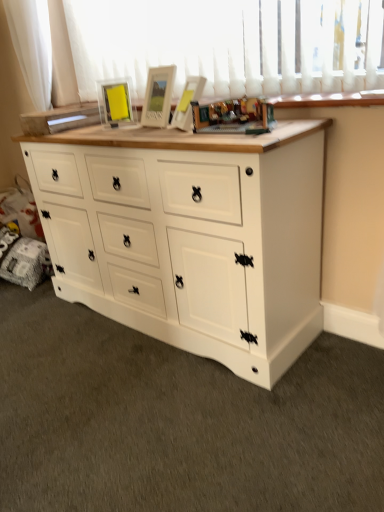
What do you see at coordinates (190, 236) in the screenshot?
I see `white painted wood chest of drawers at center` at bounding box center [190, 236].

The image size is (384, 512). What do you see at coordinates (32, 47) in the screenshot? I see `white fabric curtain at upper left` at bounding box center [32, 47].

You are a GUI agent. You are given a task and a screenshot of the screen. Output one action in this format:
    pyautogui.click(x=<x>, y=<y>)
    Task: Click on the white fabric curtain at upper left
    This screenshot has width=384, height=512.
    Given the screenshot: What is the action you would take?
    [x=32, y=47]

The width and height of the screenshot is (384, 512). What are the coordinates of `matte glass picture frame at upper center` in the screenshot? It's located at (115, 102).

Measure the distance between matte glass picture frame at upper center and camera.

Answer: matte glass picture frame at upper center is 1.73 meters away from camera.

At what (x,y) coordinates should I click in order to perform the action: click on white painted wood chest of drawers at center. Please return your answer as a coordinate pair (x, y). Looking at the image, I should click on (190, 236).

From the image's perspective, who appears lower, matte glass picture frame at upper center or white painted wood chest of drawers at center?

white painted wood chest of drawers at center, from the image's perspective.

Is matte glass picture frame at upper center turned away from white painted wood chest of drawers at center?

No, matte glass picture frame at upper center is not facing away from white painted wood chest of drawers at center.

Is matte glass picture frame at upper center in front of or behind white painted wood chest of drawers at center in the image?

matte glass picture frame at upper center is behind white painted wood chest of drawers at center.

Does white painted wood chest of drawers at center have a smaller size compared to white fabric curtain at upper left?

No.

Could you measure the distance between white painted wood chest of drawers at center and white fabric curtain at upper left?

white painted wood chest of drawers at center is 3.63 feet from white fabric curtain at upper left.

Can you confirm if white painted wood chest of drawers at center is positioned to the left of white fabric curtain at upper left?

No.

Is white fabric curtain at upper left at the left side of white painted wood chest of drawers at center?

Indeed, white fabric curtain at upper left is positioned on the left side of white painted wood chest of drawers at center.

You are a GUI agent. You are given a task and a screenshot of the screen. Output one action in this format:
    pyautogui.click(x=<x>, y=<y>)
    Task: Click on the chest of drawers below the white fabric curtain at upper left (from a real-world perspective)
    The height and width of the screenshot is (512, 384).
    Given the screenshot: What is the action you would take?
    pyautogui.click(x=190, y=236)

Does point (44, 100) appear closer or farther from the camera than point (286, 290)?

Point (44, 100) is positioned farther from the camera compared to point (286, 290).

Is white painted wood chest of drawers at center located within white fabric curtain at upper left?

No, white painted wood chest of drawers at center is not a part of white fabric curtain at upper left.

Based on the photo, how many degrees apart are the facing directions of wooden toy at center and white painted wood chest of drawers at center?

There is a 3.06-degree angle between the facing directions of wooden toy at center and white painted wood chest of drawers at center.

Is wooden toy at center bigger or smaller than white painted wood chest of drawers at center?

wooden toy at center is smaller than white painted wood chest of drawers at center.

Based on the photo, considering the sizes of objects wooden toy at center and white painted wood chest of drawers at center in the image provided, who is shorter, wooden toy at center or white painted wood chest of drawers at center?

Standing shorter between the two is wooden toy at center.

Does wooden toy at center have a lesser width compared to white painted wood chest of drawers at center?

Correct, the width of wooden toy at center is less than that of white painted wood chest of drawers at center.

From a real-world perspective, is wooden toy at center below matte glass picture frame at upper center?

Yes, from a real-world perspective, wooden toy at center is below matte glass picture frame at upper center.

Looking at their sizes, would you say wooden toy at center is wider or thinner than matte glass picture frame at upper center?

wooden toy at center is wider than matte glass picture frame at upper center.

Which of these two, wooden toy at center or matte glass picture frame at upper center, is bigger?

wooden toy at center is bigger.

Is wooden toy at center in contact with matte glass picture frame at upper center?

They are not placed beside each other.

From a real-world perspective, is matte glass picture frame at upper center positioned above or below wooden toy at center?

From a real-world perspective, matte glass picture frame at upper center is physically above wooden toy at center.

Is matte glass picture frame at upper center placed right next to wooden toy at center?

No, matte glass picture frame at upper center is not making contact with wooden toy at center.

Locate an element on the screen. The image size is (384, 512). picture frame to the left of wooden toy at center is located at coordinates (115, 102).

Looking at the image, does matte glass picture frame at upper center seem bigger or smaller compared to wooden toy at center?

Clearly, matte glass picture frame at upper center is smaller in size than wooden toy at center.

Would you say white painted wood chest of drawers at center is to the left or to the right of wooden toy at center in the picture?

In the image, white painted wood chest of drawers at center appears on the left side of wooden toy at center.

Is white painted wood chest of drawers at center beside wooden toy at center?

No.

Is wooden toy at center completely or partially inside white painted wood chest of drawers at center?

No, wooden toy at center is located outside of white painted wood chest of drawers at center.

Looking at this image, could you tell me if white painted wood chest of drawers at center is turned towards wooden toy at center?

No, white painted wood chest of drawers at center is not turned towards wooden toy at center.

Where is `chest of drawers in front of the matte glass picture frame at upper center`? chest of drawers in front of the matte glass picture frame at upper center is located at coordinates (190, 236).

Where is `curtain behind the white painted wood chest of drawers at center`? This screenshot has height=512, width=384. curtain behind the white painted wood chest of drawers at center is located at coordinates (32, 47).

Estimate the real-world distances between objects in this image. Which object is closer to matte glass picture frame at upper center, white fabric curtain at upper left or wooden toy at center?

white fabric curtain at upper left lies closer to matte glass picture frame at upper center than the other object.

Estimate the real-world distances between objects in this image. Which object is closer to white painted wood chest of drawers at center, wooden toy at center or matte glass picture frame at upper center?

Among the two, wooden toy at center is located nearer to white painted wood chest of drawers at center.

Considering their positions, is matte glass picture frame at upper center positioned closer to white fabric curtain at upper left than wooden toy at center?

matte glass picture frame at upper center.

When comparing their distances from matte glass picture frame at upper center, does white painted wood chest of drawers at center or white fabric curtain at upper left seem closer?

Based on the image, white fabric curtain at upper left appears to be nearer to matte glass picture frame at upper center.

When comparing their distances from white painted wood chest of drawers at center, does white fabric curtain at upper left or wooden toy at center seem further?

white fabric curtain at upper left is positioned further to the anchor white painted wood chest of drawers at center.

When comparing their distances from wooden toy at center, does white painted wood chest of drawers at center or white fabric curtain at upper left seem closer?

white painted wood chest of drawers at center is closer to wooden toy at center.

Estimate the real-world distances between objects in this image. Which object is closer to matte glass picture frame at upper center, wooden toy at center or white fabric curtain at upper left?

Based on the image, white fabric curtain at upper left appears to be nearer to matte glass picture frame at upper center.

When comparing their distances from wooden toy at center, does white fabric curtain at upper left or white painted wood chest of drawers at center seem closer?

white painted wood chest of drawers at center is positioned closer to the anchor wooden toy at center.

I want to click on toy positioned between white painted wood chest of drawers at center and matte glass picture frame at upper center from near to far, so click(229, 116).

This screenshot has width=384, height=512. Find the location of `picture frame between white fabric curtain at upper left and white painted wood chest of drawers at center in the vertical direction`. picture frame between white fabric curtain at upper left and white painted wood chest of drawers at center in the vertical direction is located at coordinates (115, 102).

At what (x,y) coordinates should I click in order to perform the action: click on the chest of drawers located between white fabric curtain at upper left and wooden toy at center in the left-right direction. Please return your answer as a coordinate pair (x, y). This screenshot has width=384, height=512. Looking at the image, I should click on (190, 236).

Locate an element on the screen. This screenshot has width=384, height=512. picture frame between white fabric curtain at upper left and wooden toy at center is located at coordinates (115, 102).